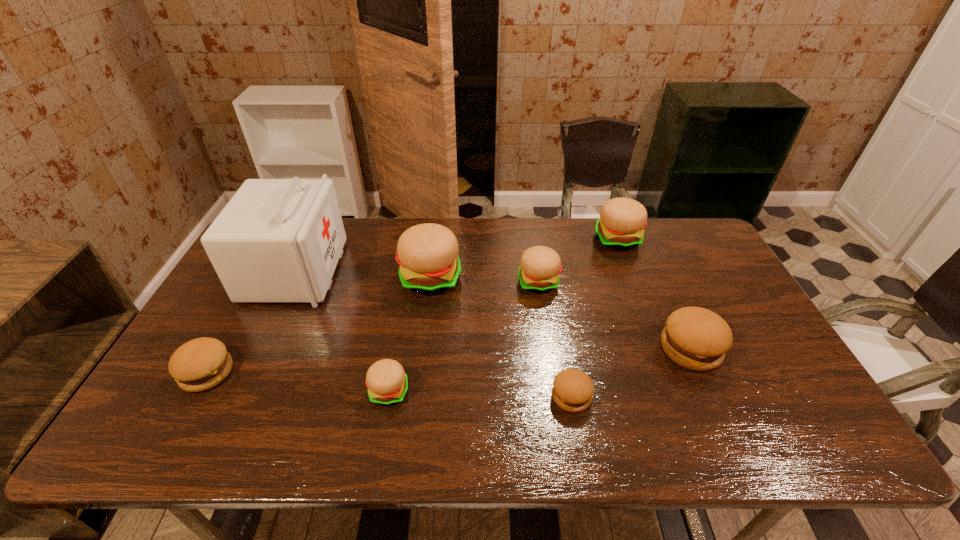
At what (x,y) coordinates should I click in order to perform the action: click on vacant area situated on the right of the smallest brown hamburger. Please return your answer as a coordinate pair (x, y). This screenshot has width=960, height=540. Looking at the image, I should click on (633, 396).

Find the location of a particular element. This screenshot has height=540, width=960. the first-aid kit that is at the far edge is located at coordinates (277, 240).

The height and width of the screenshot is (540, 960). In order to click on the first-aid kit present at the left edge in this screenshot , I will do `click(277, 240)`.

You are a GUI agent. You are given a task and a screenshot of the screen. Output one action in this format:
    pyautogui.click(x=<x>, y=<y>)
    Task: Click on the hamburger located at the left edge
    The width and height of the screenshot is (960, 540).
    Given the screenshot: What is the action you would take?
    pyautogui.click(x=202, y=363)

The height and width of the screenshot is (540, 960). I want to click on object present at the right edge, so click(x=696, y=338).

Locate an element on the screen. Image resolution: width=960 pixels, height=540 pixels. object positioned at the far left corner is located at coordinates (277, 240).

This screenshot has height=540, width=960. What are the coordinates of `vacant space at the far edge` in the screenshot? It's located at (412, 225).

This screenshot has width=960, height=540. Identify the location of vacant space at the near edge of the desktop. (681, 439).

In the image, there is a desktop. At what (x,y) coordinates should I click in order to perform the action: click on free space at the left edge. Please return your answer as a coordinate pair (x, y). This screenshot has height=540, width=960. Looking at the image, I should click on (250, 307).

Where is `vacant space at the near left corner of the desktop`? Image resolution: width=960 pixels, height=540 pixels. vacant space at the near left corner of the desktop is located at coordinates (139, 434).